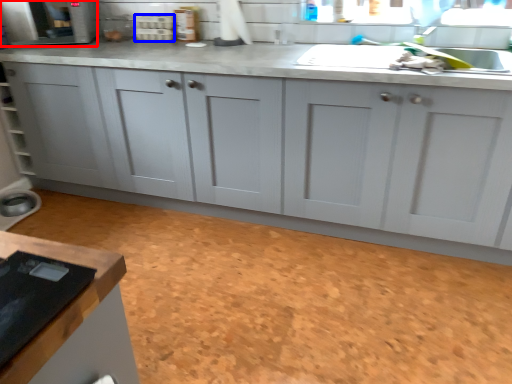
Question: Which point is closer to the camera, appliance (highlighted by a red box) or appliance (highlighted by a blue box)?

Choices:
 (A) appliance
 (B) appliance

Answer: (A)